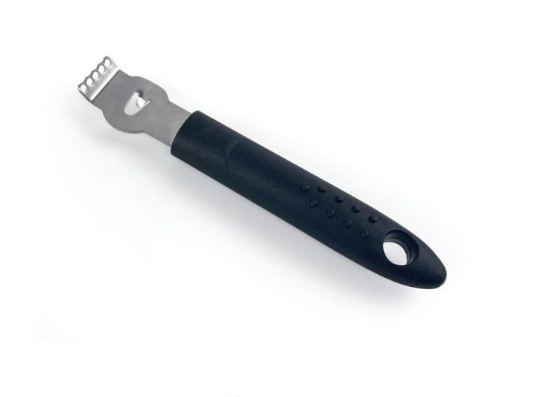
Where is `handle`? This screenshot has height=397, width=536. handle is located at coordinates (296, 187).